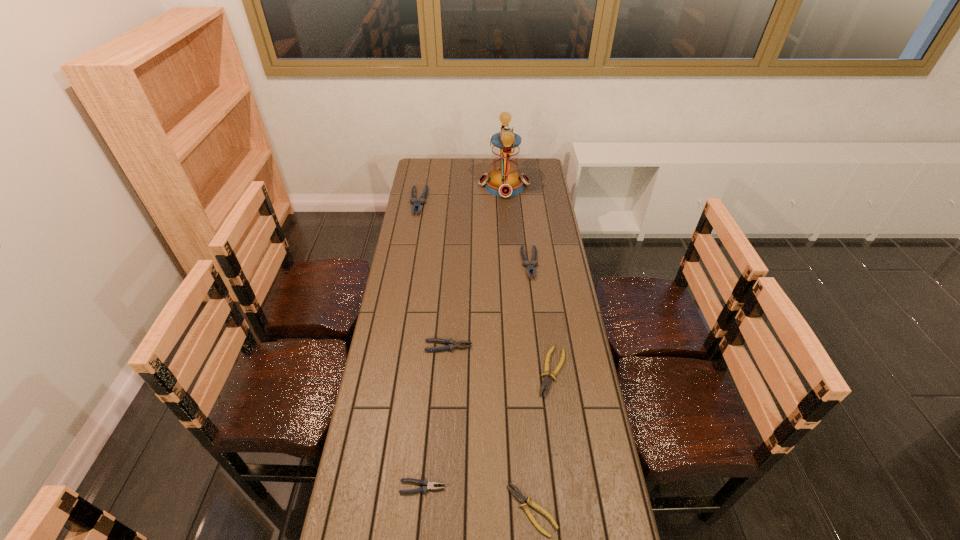
Find the location of a particular element. The width and height of the screenshot is (960, 540). lantern is located at coordinates (504, 180).

Where is `the leftmost pliers`? the leftmost pliers is located at coordinates (413, 200).

This screenshot has height=540, width=960. Identify the location of the farthest pliers. (413, 200).

Locate an element on the screen. the fifth shortest pliers is located at coordinates (526, 262).

This screenshot has height=540, width=960. Identify the location of the second biggest gray pliers. (526, 262).

The width and height of the screenshot is (960, 540). What are the coordinates of `the fourth shortest object` in the screenshot? It's located at (452, 344).

What are the coordinates of `the third tallest pliers` in the screenshot? It's located at (452, 344).

At what (x,y) coordinates should I click in order to perform the action: click on the bigger yellow pliers. Please return your answer as a coordinate pair (x, y). Image resolution: width=960 pixels, height=540 pixels. Looking at the image, I should click on click(x=546, y=382).

Image resolution: width=960 pixels, height=540 pixels. Find the location of `the nearest gray pliers`. the nearest gray pliers is located at coordinates (424, 488).

Locate an element on the screen. This screenshot has height=540, width=960. the nearer yellow pliers is located at coordinates (519, 496).